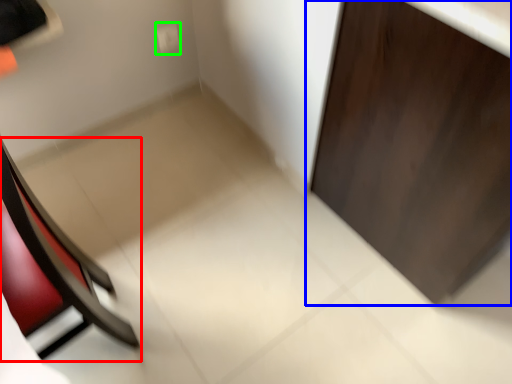
Question: Which is nearer to the chair (highlighted by a red box)? door (highlighted by a blue box) or electric outlet (highlighted by a green box).

Choices:
 (A) door
 (B) electric outlet

Answer: (A)